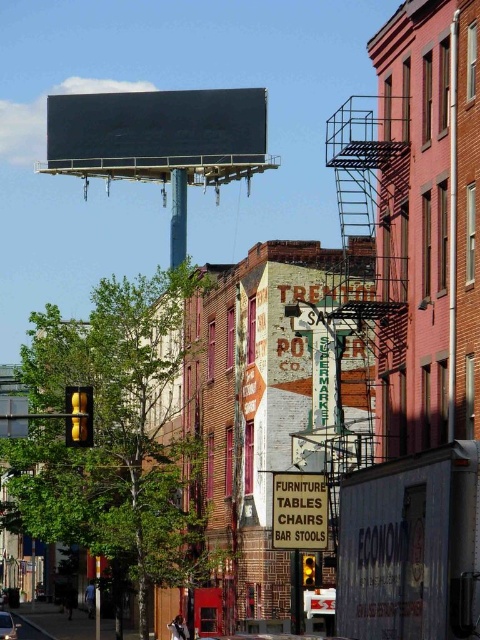
Question: Is yellow matte traffic light at lower left further to the viewer compared to yellow glass traffic light at upper center?

Choices:
 (A) no
 (B) yes

Answer: (A)

Question: Which object is the farthest from the yellow glass traffic light at upper center?

Choices:
 (A) black matte billboard at upper center
 (B) yellow matte traffic light at lower left
 (C) shiny silver car at center

Answer: (A)

Question: Which of the following is the farthest from the observer?

Choices:
 (A) (302, 580)
 (B) (49, 124)

Answer: (B)

Question: Considering the real-world distances, which object is closest to the shiny silver car at center?

Choices:
 (A) white cardboard sign at center
 (B) yellow matte traffic light at lower left
 (C) yellow glass traffic light at upper center
 (D) black matte billboard at upper center

Answer: (D)

Question: Can you confirm if shiny silver car at center is thinner than yellow glass traffic light at upper center?

Choices:
 (A) yes
 (B) no

Answer: (B)

Question: Does white cardboard sign at center have a greater width compared to yellow glass traffic light at upper center?

Choices:
 (A) no
 (B) yes

Answer: (B)